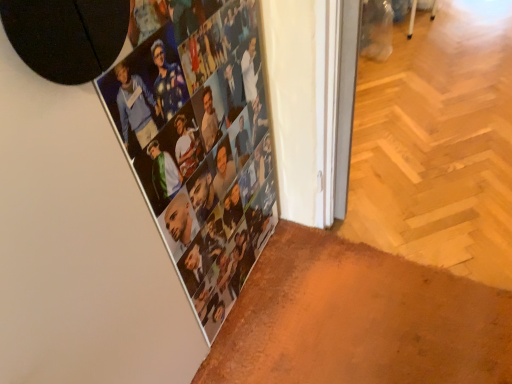
Question: Should I look upward or downward to see metallic silver photo collage at upper left?

Choices:
 (A) up
 (B) down

Answer: (A)